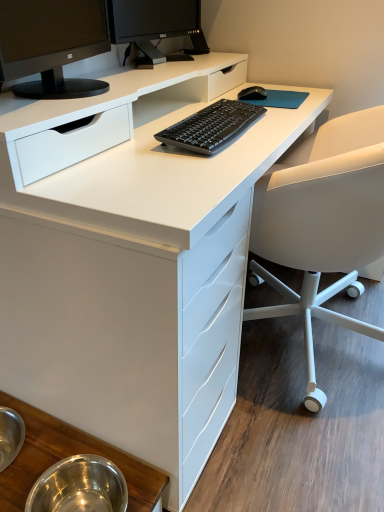
Measure the distance between white matte office chair at right and camera.

They are 87.21 centimeters apart.

Locate an element on the screen. black glossy monitor at upper center, marked as the 2th computer monitor in a front-to-back arrangement is located at coordinates (155, 25).

The height and width of the screenshot is (512, 384). What do you see at coordinates (211, 127) in the screenshot?
I see `black matte keyboard at center` at bounding box center [211, 127].

You are a GUI agent. You are given a task and a screenshot of the screen. Output one action in this format:
    pyautogui.click(x=<x>, y=<y>)
    Task: Click on the white matte office chair at right
    Image resolution: width=384 pixels, height=512 pixels.
    Given the screenshot: What is the action you would take?
    pyautogui.click(x=322, y=223)

Would you say black glossy monitor at upper center, which ranks as the 1th computer monitor in back-to-front order, is inside or outside black matte keyboard at center?

black glossy monitor at upper center, which ranks as the 1th computer monitor in back-to-front order, is not inside black matte keyboard at center, it's outside.

Relative to black matte keyboard at center, is black glossy monitor at upper center, which ranks as the 1th computer monitor in back-to-front order, in front or behind?

Clearly, black glossy monitor at upper center, which ranks as the 1th computer monitor in back-to-front order, is behind black matte keyboard at center.

Is black glossy monitor at upper center, which ranks as the 1th computer monitor in back-to-front order, shorter than black matte keyboard at center?

No, black glossy monitor at upper center, which ranks as the 1th computer monitor in back-to-front order, is not shorter than black matte keyboard at center.

Is black glossy monitor at upper center, which ranks as the 1th computer monitor in back-to-front order, next to black matte keyboard at center?

black glossy monitor at upper center, which ranks as the 1th computer monitor in back-to-front order, and black matte keyboard at center are clearly separated.

Is point (51, 69) in front of point (181, 29)?

That is True.

Considering the sizes of matte black monitor at upper left, the 1th computer monitor positioned from the front, and black glossy monitor at upper center, which ranks as the 1th computer monitor in back-to-front order, in the image, is matte black monitor at upper left, the 1th computer monitor positioned from the front, bigger or smaller than black glossy monitor at upper center, which ranks as the 1th computer monitor in back-to-front order,?

In the image, matte black monitor at upper left, the 1th computer monitor positioned from the front, appears to be larger than black glossy monitor at upper center, which ranks as the 1th computer monitor in back-to-front order.

Considering their positions, is matte black monitor at upper left, the 1th computer monitor positioned from the front, located in front of or behind black glossy monitor at upper center, which ranks as the 1th computer monitor in back-to-front order?

matte black monitor at upper left, the 1th computer monitor positioned from the front, is positioned closer to the viewer than black glossy monitor at upper center, which ranks as the 1th computer monitor in back-to-front order.

Between matte black monitor at upper left, the 2th computer monitor from the back, and black glossy monitor at upper center, which ranks as the 1th computer monitor in back-to-front order, which one appears on the right side from the viewer's perspective?

black glossy monitor at upper center, which ranks as the 1th computer monitor in back-to-front order.

From a real-world perspective, does black glossy monitor at upper center, marked as the 2th computer monitor in a front-to-back arrangement, sit lower than white matte office chair at right?

No, from a real-world perspective, black glossy monitor at upper center, marked as the 2th computer monitor in a front-to-back arrangement, is not under white matte office chair at right.

In terms of height, does black glossy monitor at upper center, which ranks as the 1th computer monitor in back-to-front order, look taller or shorter compared to white matte office chair at right?

black glossy monitor at upper center, which ranks as the 1th computer monitor in back-to-front order, is shorter than white matte office chair at right.

Is white matte office chair at right inside black glossy monitor at upper center, marked as the 2th computer monitor in a front-to-back arrangement?

Definitely not — white matte office chair at right is not inside black glossy monitor at upper center, marked as the 2th computer monitor in a front-to-back arrangement.

Is matte black monitor at upper left, the 2th computer monitor from the back, at the back of white matte office chair at right?

That's not correct — white matte office chair at right is not looking away from matte black monitor at upper left, the 2th computer monitor from the back.

Is white matte office chair at right not inside matte black monitor at upper left, the 2th computer monitor from the back?

Yes, white matte office chair at right is located beyond the bounds of matte black monitor at upper left, the 2th computer monitor from the back.

Which object is further away from the camera, white matte office chair at right or matte black monitor at upper left, the 2th computer monitor from the back?

white matte office chair at right is further away from the camera.

What's the angular difference between white matte office chair at right and matte black monitor at upper left, the 1th computer monitor positioned from the front,'s facing directions?

There is a 165-degree angle between the facing directions of white matte office chair at right and matte black monitor at upper left, the 1th computer monitor positioned from the front.

From the image's perspective, which one is positioned lower, white matte office chair at right or black glossy monitor at upper center, which ranks as the 1th computer monitor in back-to-front order?

white matte office chair at right appears lower in the image.

Could you tell me if white matte office chair at right is turned towards black glossy monitor at upper center, marked as the 2th computer monitor in a front-to-back arrangement?

A: Yes, white matte office chair at right is oriented towards black glossy monitor at upper center, marked as the 2th computer monitor in a front-to-back arrangement.

Is black glossy monitor at upper center, which ranks as the 1th computer monitor in back-to-front order, completely or partially inside white matte office chair at right?

No, black glossy monitor at upper center, which ranks as the 1th computer monitor in back-to-front order, is not inside white matte office chair at right.

From a real-world perspective, is white matte office chair at right physically located above or below black glossy monitor at upper center, marked as the 2th computer monitor in a front-to-back arrangement?

white matte office chair at right is situated lower than black glossy monitor at upper center, marked as the 2th computer monitor in a front-to-back arrangement, in the real world.

Between metallic stainless steel bowls at lower left and black matte keyboard at center, which one has smaller width?

black matte keyboard at center.

Between metallic stainless steel bowls at lower left and black matte keyboard at center, which one has less height?

black matte keyboard at center is shorter.

Where is `computer keyboard lying on the right of metallic stainless steel bowls at lower left`? This screenshot has height=512, width=384. computer keyboard lying on the right of metallic stainless steel bowls at lower left is located at coordinates (211, 127).

Between metallic stainless steel bowls at lower left and black matte keyboard at center, which one appears on the left side from the viewer's perspective?

Positioned to the left is metallic stainless steel bowls at lower left.

Is white matte office chair at right bigger than metallic stainless steel bowls at lower left?

Correct, white matte office chair at right is larger in size than metallic stainless steel bowls at lower left.

Can you tell me how much white matte office chair at right and metallic stainless steel bowls at lower left differ in facing direction?

89.3 degrees.

Is white matte office chair at right looking in the opposite direction of metallic stainless steel bowls at lower left?

No, white matte office chair at right's orientation is not away from metallic stainless steel bowls at lower left.

This screenshot has width=384, height=512. What are the coordinates of `chair lying behind the metallic stainless steel bowls at lower left` in the screenshot? It's located at (322, 223).

Image resolution: width=384 pixels, height=512 pixels. Find the location of `computer keyboard on the right side of black glossy monitor at upper center, which ranks as the 1th computer monitor in back-to-front order`. computer keyboard on the right side of black glossy monitor at upper center, which ranks as the 1th computer monitor in back-to-front order is located at coordinates (211, 127).

In order to click on computer monitor above the matte black monitor at upper left, the 2th computer monitor from the back (from the image's perspective) in this screenshot , I will do `click(155, 25)`.

Based on their spatial positions, is black glossy monitor at upper center, which ranks as the 1th computer monitor in back-to-front order, or matte black monitor at upper left, the 2th computer monitor from the back, further from black matte keyboard at center?

black glossy monitor at upper center, which ranks as the 1th computer monitor in back-to-front order, lies further to black matte keyboard at center than the other object.

From the image, which object appears to be farther from black glossy monitor at upper center, marked as the 2th computer monitor in a front-to-back arrangement, white matte office chair at right or matte black monitor at upper left, the 1th computer monitor positioned from the front?

Based on the image, white matte office chair at right appears to be further to black glossy monitor at upper center, marked as the 2th computer monitor in a front-to-back arrangement.

Looking at the image, which one is located further to black matte keyboard at center, matte black monitor at upper left, the 1th computer monitor positioned from the front, or white matte office chair at right?

Based on the image, matte black monitor at upper left, the 1th computer monitor positioned from the front, appears to be further to black matte keyboard at center.

Estimate the real-world distances between objects in this image. Which object is further from black glossy monitor at upper center, which ranks as the 1th computer monitor in back-to-front order, black matte keyboard at center or matte black monitor at upper left, the 1th computer monitor positioned from the front?

black matte keyboard at center is positioned further to the anchor black glossy monitor at upper center, which ranks as the 1th computer monitor in back-to-front order.

Estimate the real-world distances between objects in this image. Which object is closer to matte black monitor at upper left, the 1th computer monitor positioned from the front, white matte office chair at right or black glossy monitor at upper center, marked as the 2th computer monitor in a front-to-back arrangement?

black glossy monitor at upper center, marked as the 2th computer monitor in a front-to-back arrangement, is positioned closer to the anchor matte black monitor at upper left, the 1th computer monitor positioned from the front.

Considering their positions, is white matte office chair at right positioned further to metallic stainless steel bowls at lower left than black matte keyboard at center?

black matte keyboard at center.

Based on their spatial positions, is black matte keyboard at center or matte black monitor at upper left, the 1th computer monitor positioned from the front, closer to metallic stainless steel bowls at lower left?

black matte keyboard at center.

Considering their positions, is metallic stainless steel bowls at lower left positioned further to white matte office chair at right than matte black monitor at upper left, the 1th computer monitor positioned from the front?

The object further to white matte office chair at right is metallic stainless steel bowls at lower left.

Where is `computer keyboard situated between matte black monitor at upper left, the 2th computer monitor from the back, and white matte office chair at right from left to right`? computer keyboard situated between matte black monitor at upper left, the 2th computer monitor from the back, and white matte office chair at right from left to right is located at coordinates (211, 127).

This screenshot has width=384, height=512. Identify the location of chair between black matte keyboard at center and metallic stainless steel bowls at lower left vertically. (322, 223).

Image resolution: width=384 pixels, height=512 pixels. Identify the location of computer monitor between black glossy monitor at upper center, marked as the 2th computer monitor in a front-to-back arrangement, and metallic stainless steel bowls at lower left in the up-down direction. (51, 44).

The image size is (384, 512). I want to click on computer keyboard between matte black monitor at upper left, the 2th computer monitor from the back, and metallic stainless steel bowls at lower left in the up-down direction, so click(x=211, y=127).